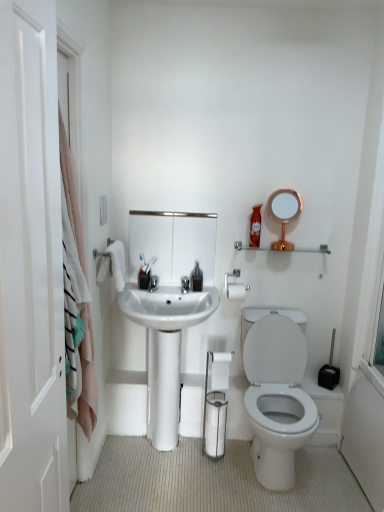
Where is `vacant region above metallic rectangular mirror at center, positioned as the 2th mirror in right-to-left order (from a real-world perspective)`? The width and height of the screenshot is (384, 512). vacant region above metallic rectangular mirror at center, positioned as the 2th mirror in right-to-left order (from a real-world perspective) is located at coordinates (172, 211).